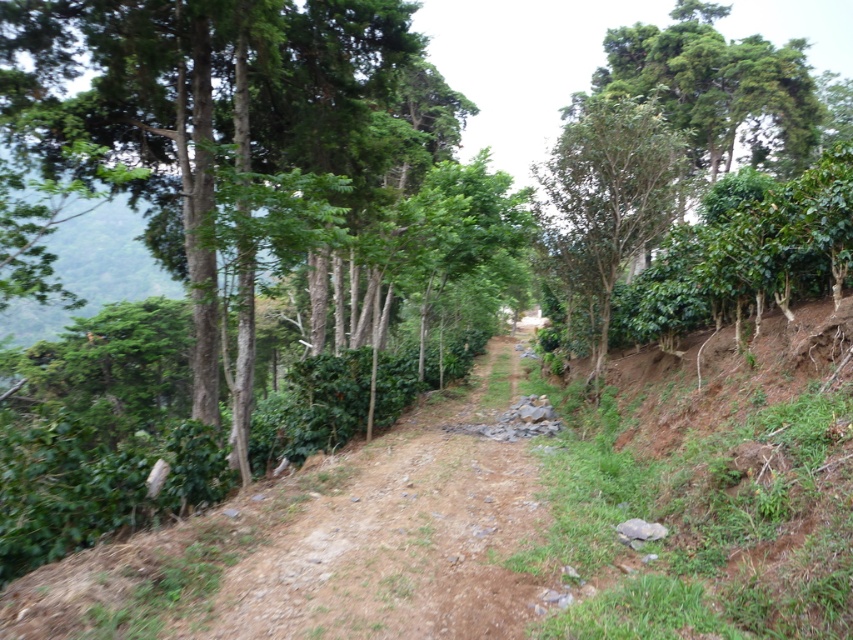
Question: Which object is farther from the camera taking this photo?

Choices:
 (A) green leafy tree at upper right
 (B) dirt path at center
 (C) green leafy tree at center

Answer: (A)

Question: Among these points, which one is nearest to the camera?

Choices:
 (A) (288, 40)
 (B) (633, 134)

Answer: (A)

Question: Is green leafy tree at center further to the viewer compared to dirt path at center?

Choices:
 (A) yes
 (B) no

Answer: (A)

Question: Which of the following is the farthest from the observer?

Choices:
 (A) (231, 104)
 (B) (245, 634)

Answer: (A)

Question: Is the position of dirt path at center less distant than that of green leafy tree at upper right?

Choices:
 (A) no
 (B) yes

Answer: (B)

Question: Can you confirm if green leafy tree at center is thinner than green leafy tree at upper right?

Choices:
 (A) yes
 (B) no

Answer: (B)